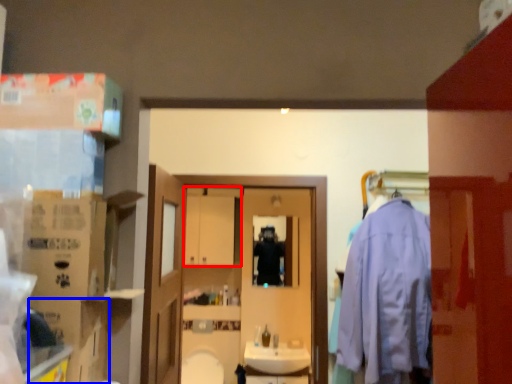
Question: Which point is further to the camera, cabinetry (highlighted by a red box) or cardboard box (highlighted by a blue box)?

Choices:
 (A) cabinetry
 (B) cardboard box

Answer: (A)